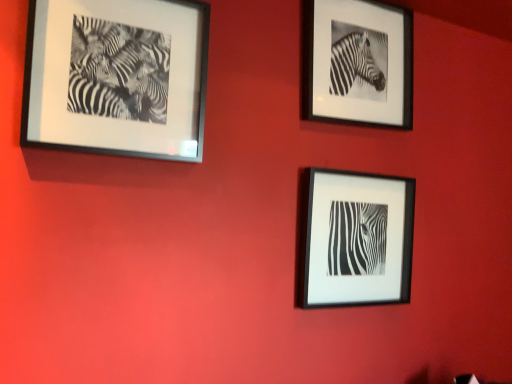
Question: From a real-world perspective, is black matte frame at upper right, the first picture frame from the right, positioned over black matte photo frame at upper left, the 3th picture frame positioned from the right, based on gravity?

Choices:
 (A) no
 (B) yes

Answer: (B)

Question: Does black matte frame at upper right, the first picture frame from the right, have a lesser width compared to black matte photo frame at upper left, which is the first picture frame from left to right?

Choices:
 (A) yes
 (B) no

Answer: (A)

Question: From the image's perspective, would you say black matte frame at upper right, which appears as the 3th picture frame when viewed from the left, is positioned over black matte photo frame at upper left, which is the first picture frame from left to right?

Choices:
 (A) no
 (B) yes

Answer: (B)

Question: Can you confirm if black matte frame at upper right, which appears as the 3th picture frame when viewed from the left, is taller than black matte photo frame at upper left, the 3th picture frame positioned from the right?

Choices:
 (A) no
 (B) yes

Answer: (B)

Question: Could you tell me if black matte frame at upper right, which appears as the 3th picture frame when viewed from the left, is turned towards black matte photo frame at upper left, the 3th picture frame positioned from the right?

Choices:
 (A) no
 (B) yes

Answer: (A)

Question: Is black matte frame at upper right, which appears as the 3th picture frame when viewed from the left, behind black matte photo frame at upper left, the 3th picture frame positioned from the right?

Choices:
 (A) yes
 (B) no

Answer: (A)

Question: Can you confirm if black matte photo frame at upper left, which is the first picture frame from left to right, is smaller than black matte frame at upper right, the first picture frame from the right?

Choices:
 (A) yes
 (B) no

Answer: (B)

Question: Can we say black matte photo frame at upper left, which is the first picture frame from left to right, lies outside black matte frame at upper right, the first picture frame from the right?

Choices:
 (A) yes
 (B) no

Answer: (A)

Question: Is black matte photo frame at upper left, the 3th picture frame positioned from the right, behind black matte frame at upper right, which appears as the 3th picture frame when viewed from the left?

Choices:
 (A) yes
 (B) no

Answer: (B)

Question: From the image's perspective, is black matte photo frame at upper left, which is the first picture frame from left to right, on top of black matte frame at upper right, which appears as the 3th picture frame when viewed from the left?

Choices:
 (A) yes
 (B) no

Answer: (B)

Question: From a real-world perspective, is black matte photo frame at upper left, the 3th picture frame positioned from the right, positioned under black matte frame at upper right, the first picture frame from the right, based on gravity?

Choices:
 (A) no
 (B) yes

Answer: (B)

Question: Does black matte photo frame at upper left, which is the first picture frame from left to right, have a greater height compared to black matte frame at upper right, which appears as the 3th picture frame when viewed from the left?

Choices:
 (A) no
 (B) yes

Answer: (A)

Question: From the image's perspective, is black matte frame at upper right, the first picture frame from the right, over black matte frame at center, which appears as the second picture frame when viewed from the right?

Choices:
 (A) yes
 (B) no

Answer: (A)